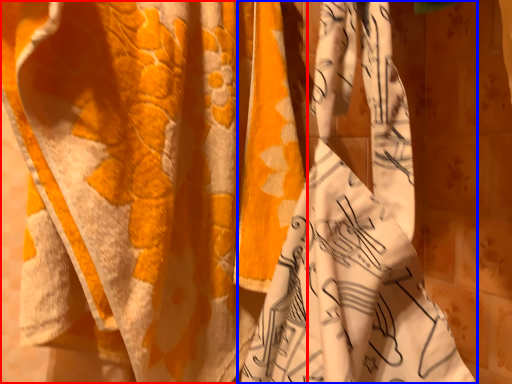
Question: Which point is further to the camera, curtain (highlighted by a red box) or curtain (highlighted by a blue box)?

Choices:
 (A) curtain
 (B) curtain

Answer: (A)